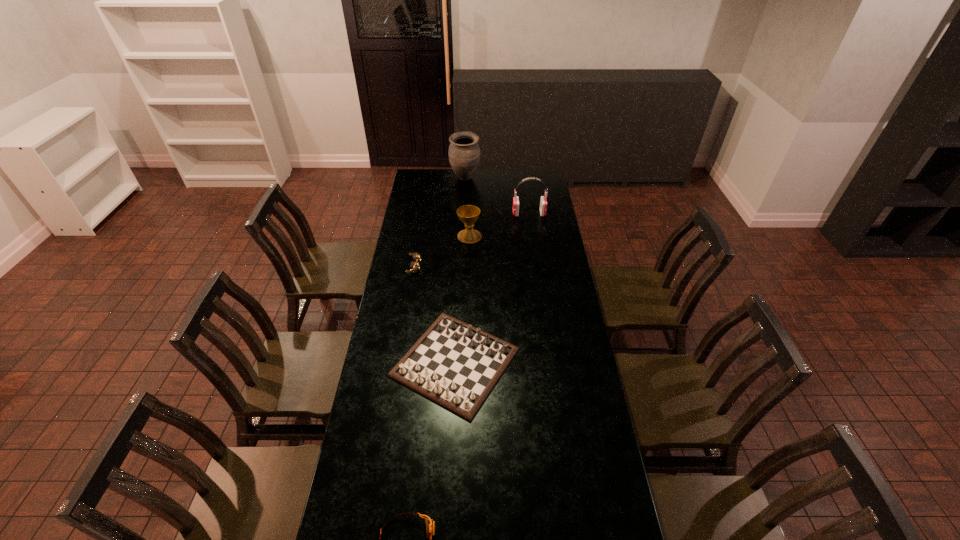
Locate an element on the screen. Image resolution: width=960 pixels, height=540 pixels. the tallest object is located at coordinates (464, 152).

This screenshot has height=540, width=960. In order to click on the farthest object in this screenshot , I will do `click(464, 152)`.

At what (x,y) coordinates should I click in order to perform the action: click on the second farthest object. Please return your answer as a coordinate pair (x, y). This screenshot has width=960, height=540. Looking at the image, I should click on pyautogui.click(x=543, y=202).

At what (x,y) coordinates should I click in order to perform the action: click on the rightmost object. Please return your answer as a coordinate pair (x, y). The height and width of the screenshot is (540, 960). Looking at the image, I should click on (543, 202).

What are the coordinates of `chalice` in the screenshot? It's located at (468, 214).

Find the location of `the third tallest object`. the third tallest object is located at coordinates (468, 214).

The image size is (960, 540). I want to click on chessboard, so click(x=454, y=364).

Where is `the fifth farthest object`? The width and height of the screenshot is (960, 540). the fifth farthest object is located at coordinates (454, 364).

What are the coordinates of `the fourth farthest object` in the screenshot? It's located at (415, 266).

At what (x,y) coordinates should I click in order to perform the action: click on vacant space located 0.150m on the left of the farthest object. Please return your answer as a coordinate pair (x, y). The height and width of the screenshot is (540, 960). Looking at the image, I should click on point(425,178).